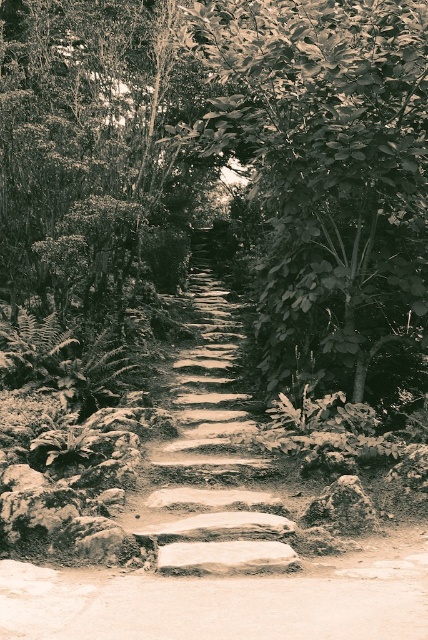
Question: Can you confirm if leathery green leafy tree at center is positioned to the left of smooth gray rock at lower right?

Choices:
 (A) yes
 (B) no

Answer: (A)

Question: Which of these objects is positioned closest to the leathery green leafy tree at center?

Choices:
 (A) smooth stone steps at center
 (B) smooth gray rock at lower right

Answer: (A)

Question: Which point appears closest to the camera in this image?

Choices:
 (A) (341, 61)
 (B) (152, 492)

Answer: (A)

Question: Does smooth stone steps at center appear under smooth gray rock at lower right?

Choices:
 (A) yes
 (B) no

Answer: (B)

Question: Does leathery green leafy tree at center have a greater width compared to smooth gray rock at lower right?

Choices:
 (A) no
 (B) yes

Answer: (B)

Question: Among these objects, which one is nearest to the camera?

Choices:
 (A) smooth stone steps at center
 (B) smooth gray rock at lower right
 (C) leathery green leafy tree at center

Answer: (A)